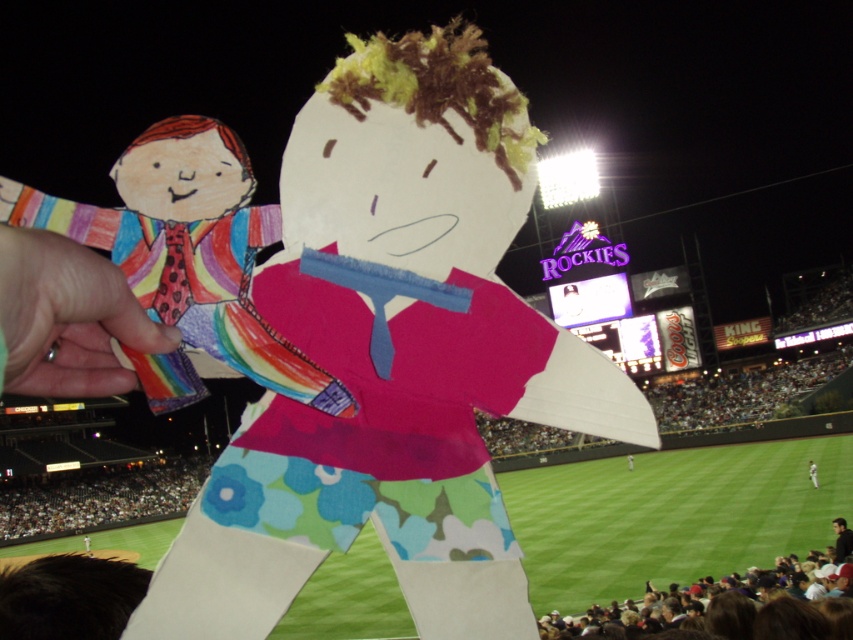
You are standing at the center of the field during the baseball game and want to throw a ball to a friend. There are two points marked in the image where your friend could be standing. Which point is closer to you? The points are located at coordinates point (x=511, y=132) and point (x=809, y=467).

Point (x=511, y=132) is closer to the viewer than point (x=809, y=467), so the friend at point (x=511, y=132) is closer.

You are a photographer at the baseball game and want to take a photo of both the matte paper doll at center and the blue floral pants at center in the same frame. Given that your camera has a maximum focus range of 75 meters, will you be able to capture both objects clearly in the photo?

The matte paper doll at center and blue floral pants at center are 75.25 meters apart. Since the camera can only focus up to 75 meters, the distance between them exceeds the maximum focus range. Therefore, you won cannot capture both objects clearly in the same frame.

Based on the photo, you are at the baseball game and want to take a photo of both the matte paper doll at center and the blue floral pants at center in the same frame. Based on their positions, which object should you position on the left side of your camera viewfinder to include both?

The matte paper doll at center is to the left of blue floral pants at center, so you should position the matte paper doll at center on the left side of your camera viewfinder to include both in the same frame.